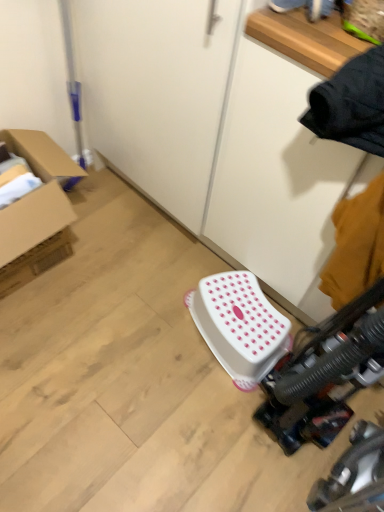
Question: In the image, is cardboard box at left positioned in front of or behind white plastic stool at center?

Choices:
 (A) behind
 (B) front

Answer: (B)

Question: From the image's perspective, is cardboard box at left above or below white plastic stool at center?

Choices:
 (A) below
 (B) above

Answer: (B)

Question: Is point (61, 152) positioned closer to the camera than point (261, 295)?

Choices:
 (A) farther
 (B) closer

Answer: (A)

Question: From a real-world perspective, is white plastic stool at center above or below cardboard box at left?

Choices:
 (A) above
 (B) below

Answer: (B)

Question: From the image's perspective, is white plastic stool at center above or below cardboard box at left?

Choices:
 (A) above
 (B) below

Answer: (B)

Question: From their relative heights in the image, would you say white plastic stool at center is taller or shorter than cardboard box at left?

Choices:
 (A) short
 (B) tall

Answer: (A)

Question: Considering the relative positions of white plastic stool at center and cardboard box at left in the image provided, is white plastic stool at center to the left or to the right of cardboard box at left?

Choices:
 (A) left
 (B) right

Answer: (B)